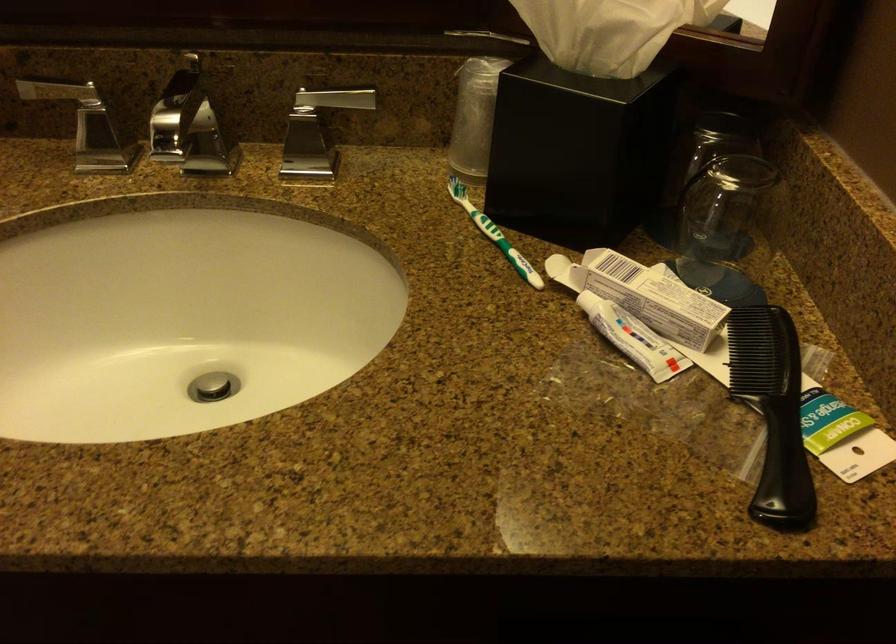
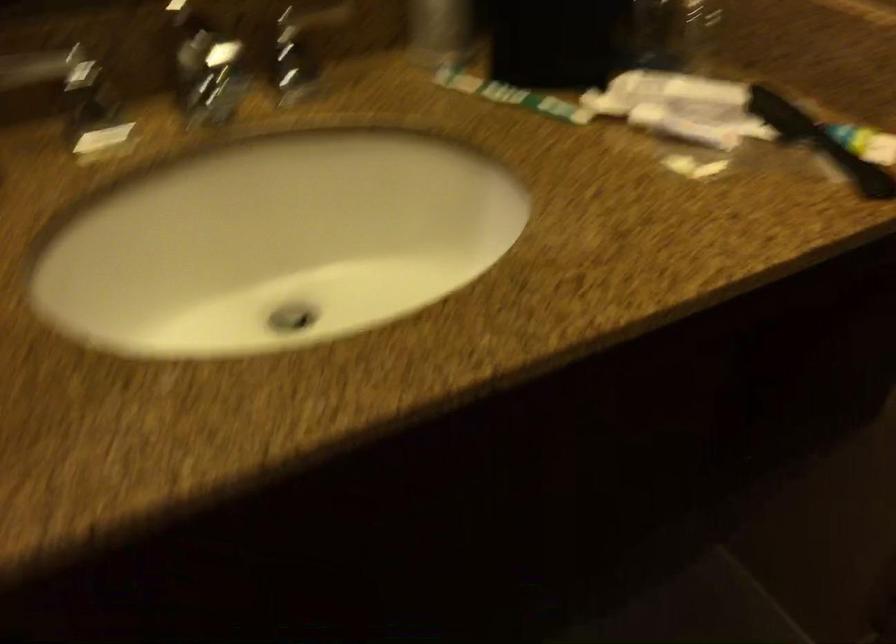
Question: The camera is either moving clockwise (left) or counter-clockwise (right) around the object. The first image is from the beginning of the video and the second image is from the end. Is the camera moving left or right when shooting the video?

Choices:
 (A) Left
 (B) Right

Answer: (A)